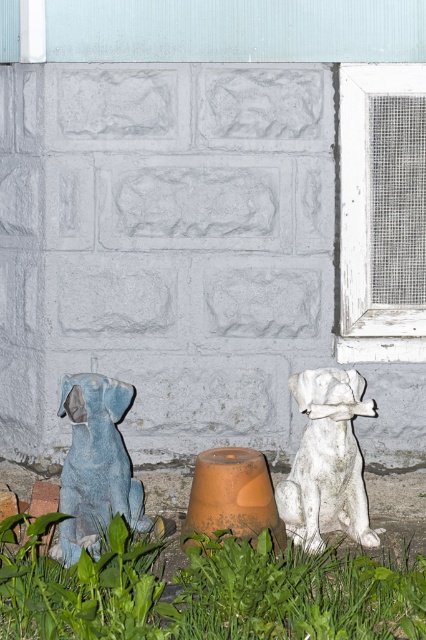
Who is shorter, green leafy grass at lower center or matte blue statue at left?

green leafy grass at lower center is shorter.

In the scene shown: Is green leafy grass at lower center wider than matte blue statue at left?

Indeed, green leafy grass at lower center has a greater width compared to matte blue statue at left.

Who is more forward, (16, 630) or (98, 476)?

Point (16, 630)

Identify the location of green leafy grass at lower center. This screenshot has height=640, width=426. (207, 593).

Between white matte dog at center and matte blue statue at left, which one appears on the left side from the viewer's perspective?

matte blue statue at left is more to the left.

Who is shorter, white matte dog at center or matte blue statue at left?

matte blue statue at left

This screenshot has height=640, width=426. Identify the location of white matte dog at center. (327, 460).

Find the location of a particular element. The image size is (426, 640). white matte dog at center is located at coordinates (327, 460).

Does green leafy grass at lower center lie behind white matte dog at center?

No, it is in front of white matte dog at center.

Who is lower down, green leafy grass at lower center or white matte dog at center?

green leafy grass at lower center is below.

Who is more forward, (264,620) or (330,378)?

Point (264,620) is in front.

At what (x,y) coordinates should I click in order to perform the action: click on green leafy grass at lower center. Please return your answer as a coordinate pair (x, y). Looking at the image, I should click on (207, 593).